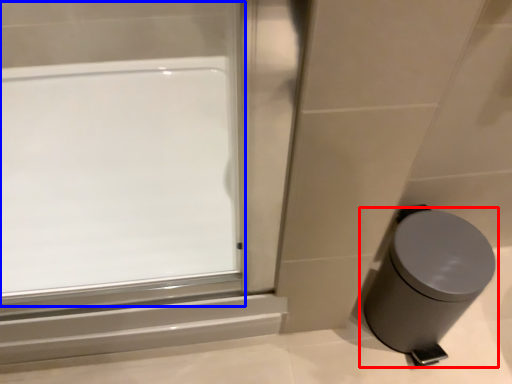
Question: Which object is further to the camera taking this photo, waste container (highlighted by a red box) or window (highlighted by a blue box)?

Choices:
 (A) waste container
 (B) window

Answer: (B)